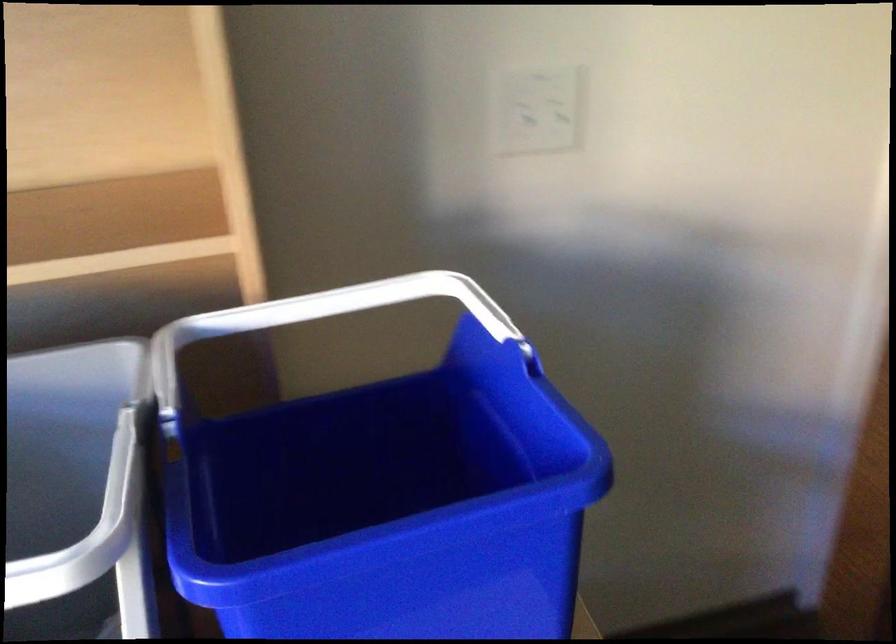
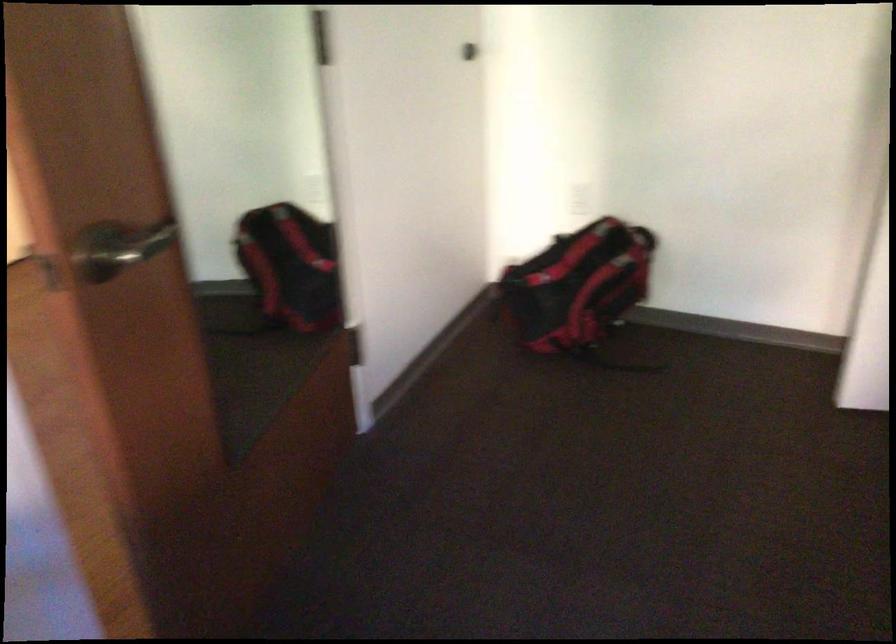
Question: The camera is either moving clockwise (left) or counter-clockwise (right) around the object. The first image is from the beginning of the video and the second image is from the end. Is the camera moving left or right when shooting the video?

Choices:
 (A) Left
 (B) Right

Answer: (A)